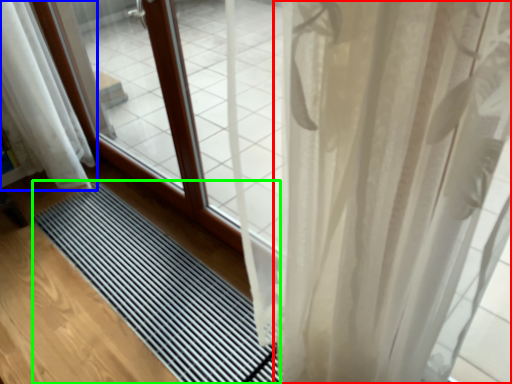
Question: Which is nearer to the curtain (highlighted by a red box)? curtain (highlighted by a blue box) or mat (highlighted by a green box).

Choices:
 (A) curtain
 (B) mat

Answer: (B)